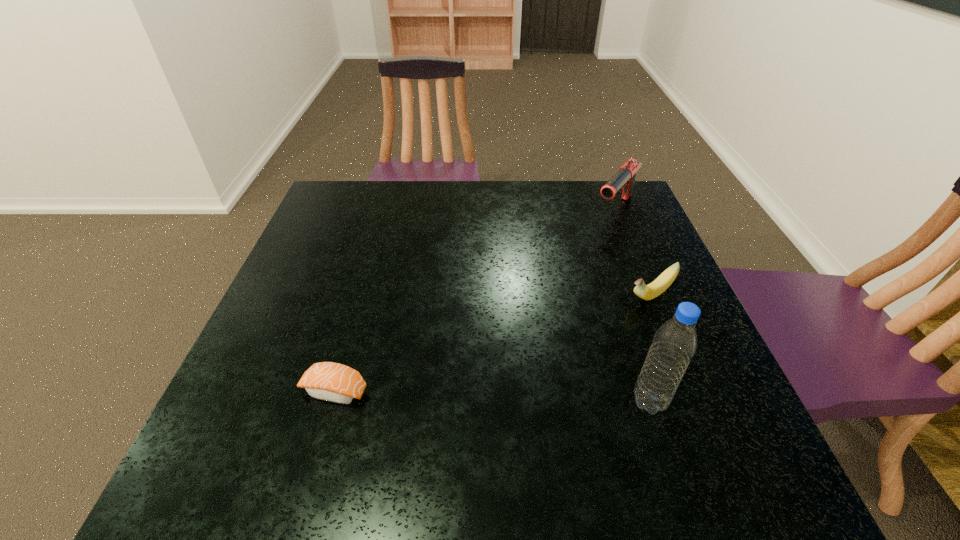
You are a GUI agent. You are given a task and a screenshot of the screen. Output one action in this format:
    pyautogui.click(x=<x>, y=<y>)
    Task: Click on the vacant space on the desktop that is between the sushi and the water bottle and is positioned at the stem of the third nearest object
    
    Given the screenshot: What is the action you would take?
    pyautogui.click(x=518, y=397)

Locate an element on the screen. This screenshot has height=540, width=960. free space on the desktop that is between the leftmost object and the tallest object and is positioned at the aiming end of the farthest object is located at coordinates (454, 395).